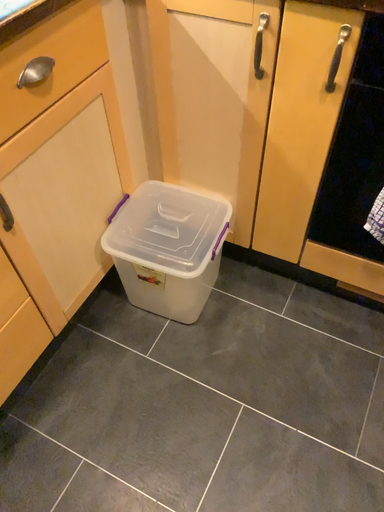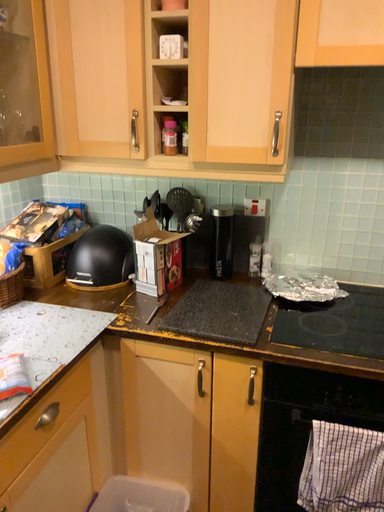
Question: How did the camera likely rotate when shooting the video?

Choices:
 (A) rotated upward
 (B) rotated downward

Answer: (A)